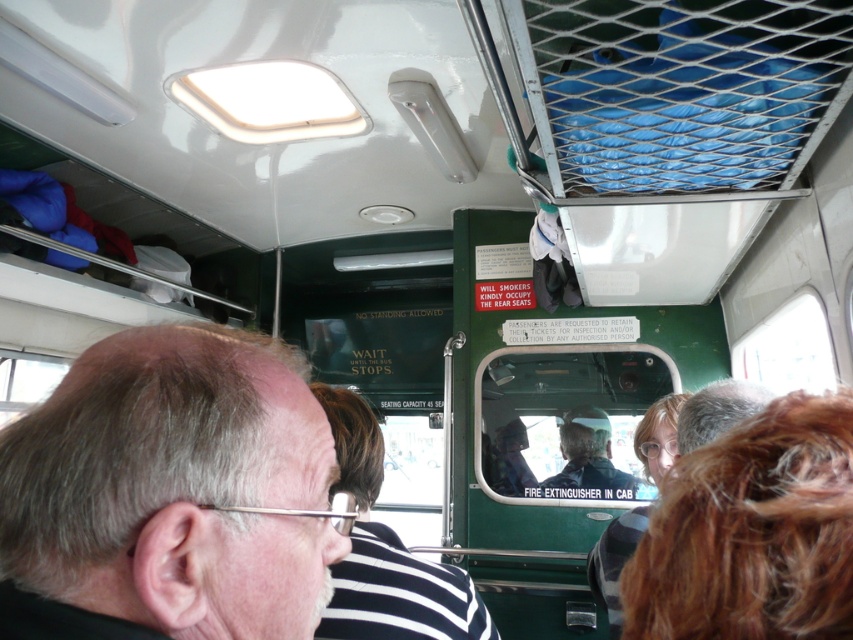
Is brown curly hair at lower right bigger than striped fabric shirt at center?

No, brown curly hair at lower right is not bigger than striped fabric shirt at center.

Is brown curly hair at lower right smaller than striped fabric shirt at center?

Yes.

You are a GUI agent. You are given a task and a screenshot of the screen. Output one action in this format:
    pyautogui.click(x=<x>, y=<y>)
    Task: Click on the brown curly hair at lower right
    The height and width of the screenshot is (640, 853).
    Given the screenshot: What is the action you would take?
    pyautogui.click(x=752, y=532)

Between gray hair at upper left and smooth skin man at center, which one has less height?

gray hair at upper left is shorter.

Which is behind, point (27, 554) or point (637, 481)?

The point (637, 481) is behind.

At what (x,y) coordinates should I click in order to perform the action: click on gray hair at upper left. Please return your answer as a coordinate pair (x, y). Looking at the image, I should click on tap(173, 486).

Between brown curly hair at lower right and smooth skin man at center, which one is positioned lower?

smooth skin man at center

Who is higher up, brown curly hair at lower right or smooth skin man at center?

Positioned higher is brown curly hair at lower right.

Where is `brown curly hair at lower right`? Image resolution: width=853 pixels, height=640 pixels. brown curly hair at lower right is located at coordinates (752, 532).